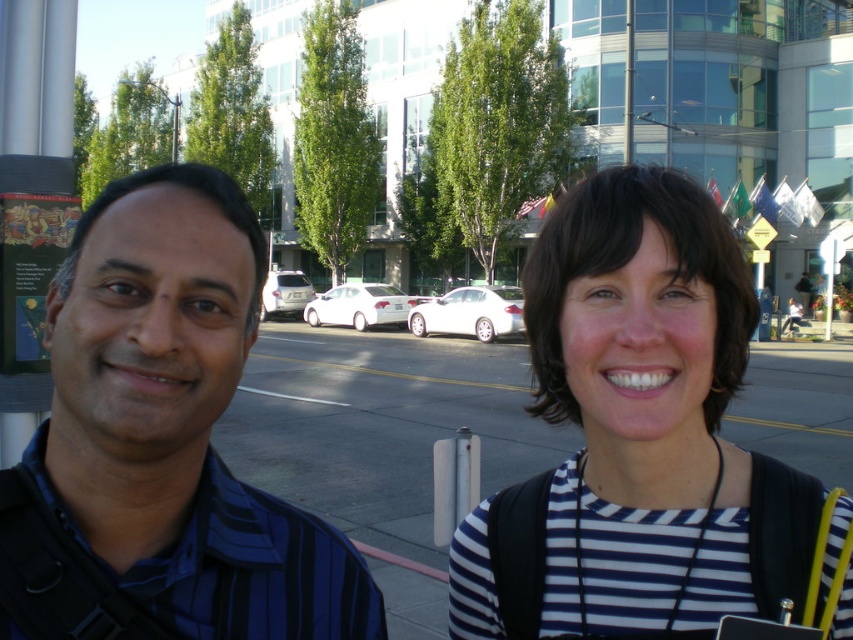
Can you confirm if white striped shirt at center is positioned to the left of blue striped shirt at left?

No, white striped shirt at center is not to the left of blue striped shirt at left.

Based on the photo, is white striped shirt at center in front of blue striped shirt at left?

No.

Is point (531, 502) behind point (283, 560)?

Yes, it is behind point (283, 560).

Locate an element on the screen. This screenshot has height=640, width=853. white striped shirt at center is located at coordinates (645, 442).